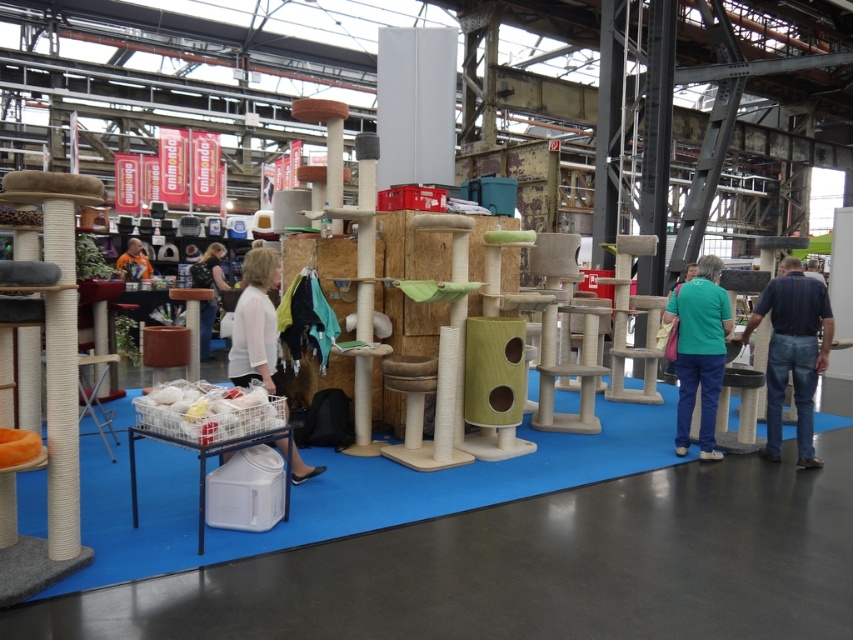
You are a customer at the exhibition and want to place a small cat toy between the blue jeans at right and the orange fabric at center. Where should you place it?

The blue jeans at right is positioned on the right side of orange fabric at center, so placing the small cat toy between them would require placing it to the right of the orange fabric at center and to the left of the blue jeans at right.

You are a customer at the exhibition and notice the white fabric at center and the green matte shirt at center. Which item is positioned lower in the display?

The white fabric at center is located below the green matte shirt at center, so it is positioned lower in the display.